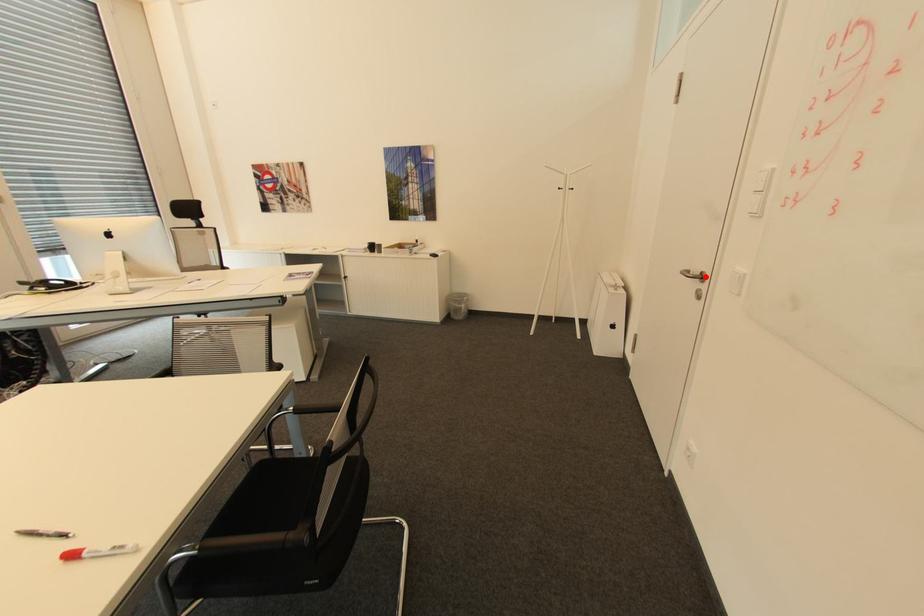
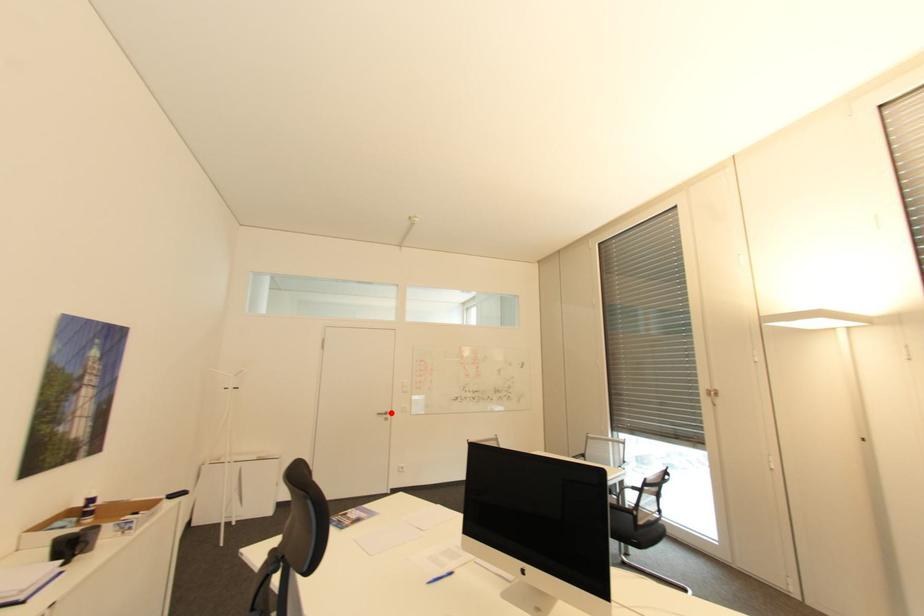
I am providing you with two images of the same scene from different viewpoints. A red point is marked on the first image and another point is marked on the second image. Do the highlighted points in image1 and image2 indicate the same real-world spot?

Yes